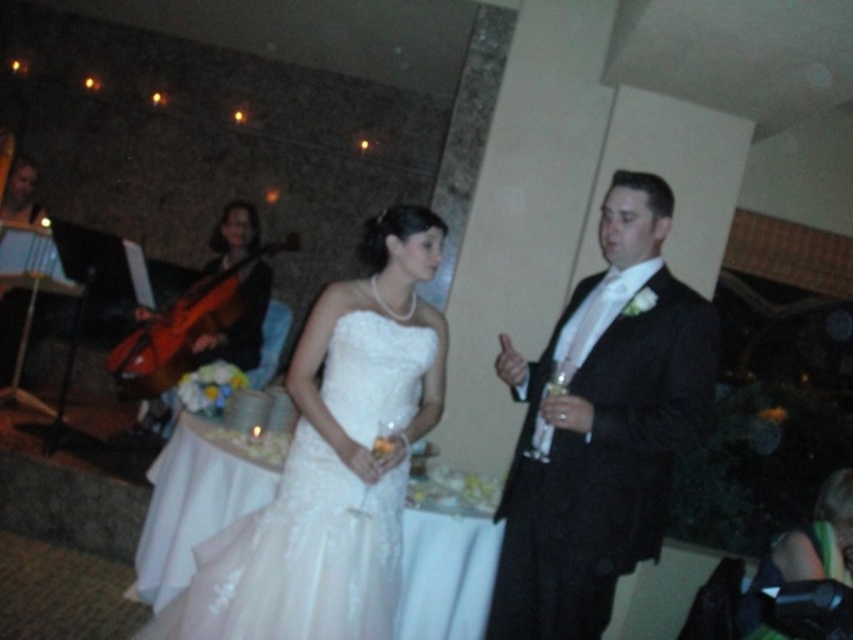
You are a photographer at the wedding reception and need to adjust the lighting to highlight the black satin tuxedo at right. Where exactly should you position the light source to ensure it illuminates the tuxedo effectively?

The black satin tuxedo at right is located at point 0.667 on the x axis and 0.706 on the y axis, so you should position the light source near those coordinates to effectively illuminate it.

You are a photographer at a wedding reception. You need to capture a group photo of the bride wearing the white satin dress at center and the bridesmaid in the white lace dress at center. Since the bridesmaid is wider, how should you position them to ensure both fit in the frame?

The white satin dress at center has a lesser width compared to the white lace dress at center. To ensure both fit in the frame, position the bridesmaid in the white lace dress at center slightly to one side so there is enough space for her wider frame, while the bride in the white satin dress at center can be centered.

You are a photographer at a wedding reception and need to capture a shot of the bride wearing the white satin dress at center and the groom in a black tuxedo. However, there is a white lace dress at center in the background. Since both dresses are white, you want to ensure the focus is on the bride. Based on their positions, which dress should you adjust your camera focus to prioritize?

The white satin dress at center is located above the white lace dress at center, so focusing on the higher position would better highlight the bride.